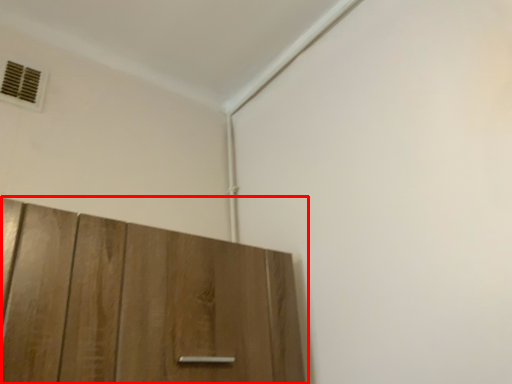
Question: Where is cupboard (annotated by the red box) located in relation to air conditioning in the image?

Choices:
 (A) left
 (B) right

Answer: (B)